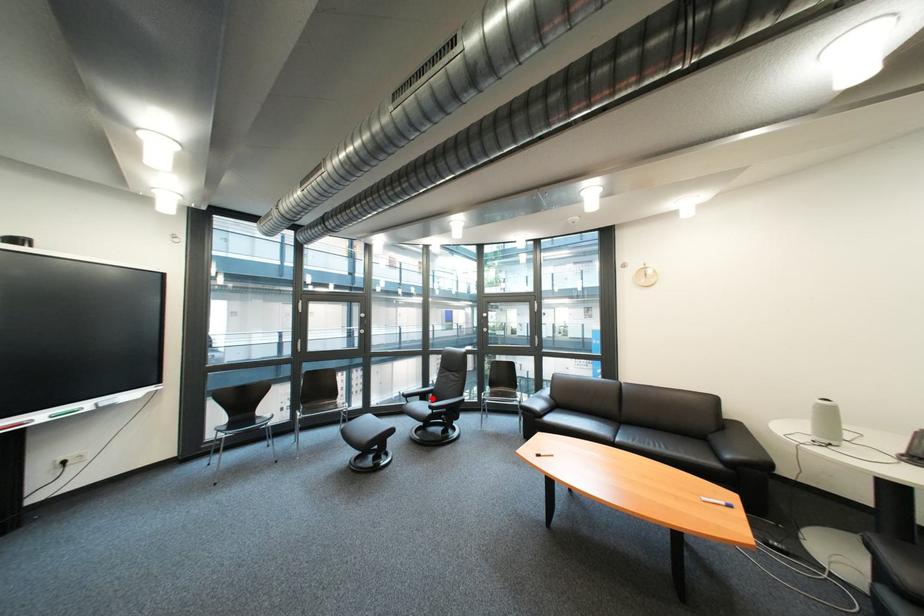
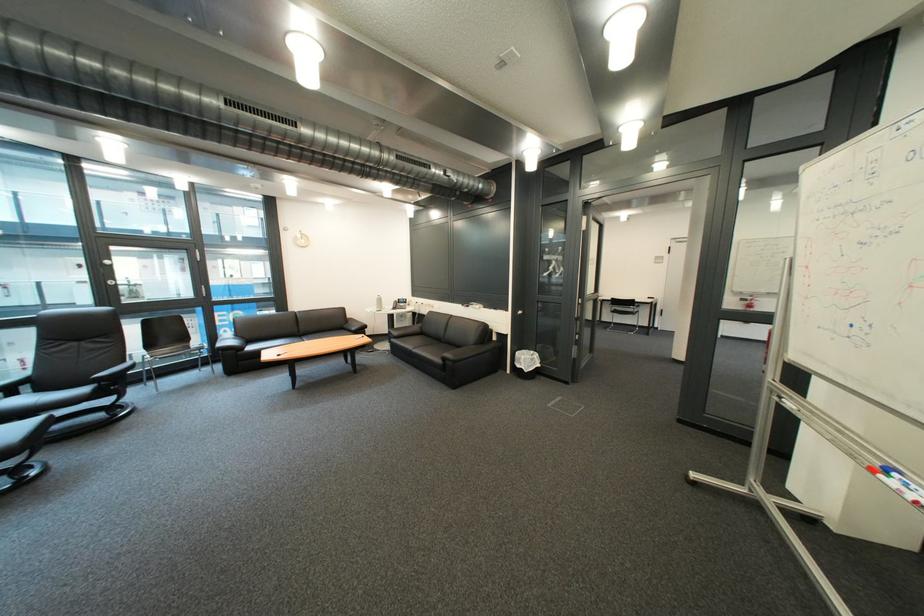
Where in the second image is the point corresponding to the highlighted location from the first image?

(16, 395)